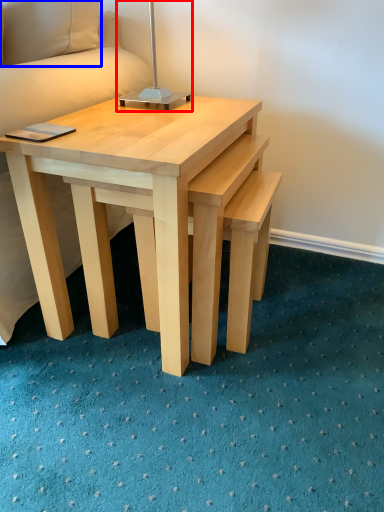
Question: Which object appears closest to the camera in this image, bedside lamp (highlighted by a red box) or pillow (highlighted by a blue box)?

Choices:
 (A) bedside lamp
 (B) pillow

Answer: (A)